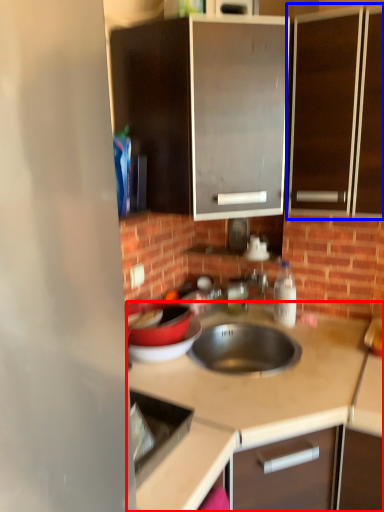
Question: Which point is closer to the camera, countertop (highlighted by a red box) or cabinetry (highlighted by a blue box)?

Choices:
 (A) countertop
 (B) cabinetry

Answer: (A)